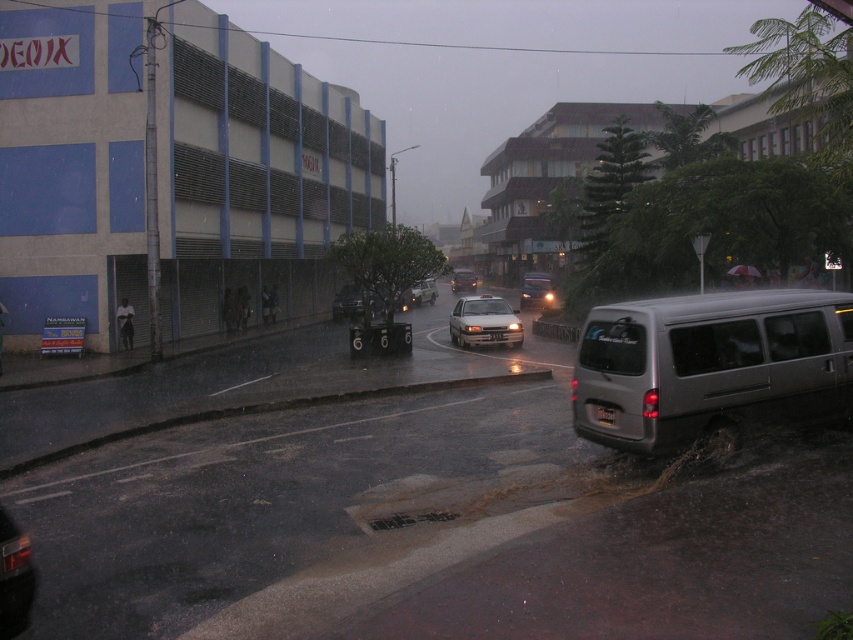
You are a pedestrian trying to cross the street from the left side where the GENIX building is located to the right side. There is a satin silver van at lower right and a shiny silver sedan at center. Which vehicle is closer to your starting position on the left side?

The shiny silver sedan at center is closer to your starting position on the left side than the satin silver van at lower right.

Looking at this image, you are standing at the point with coordinates (711, 364) in the image. What object is located at this point?

The point corresponds to the satin silver van at lower right.

You are a delivery driver trying to navigate through the rainy street scene. You need to park your vehicle near the satin silver van at lower right. What are the coordinates where you should aim to park?

The satin silver van at lower right is located at coordinates point (711, 364). Therefore, you should aim to park near those coordinates.